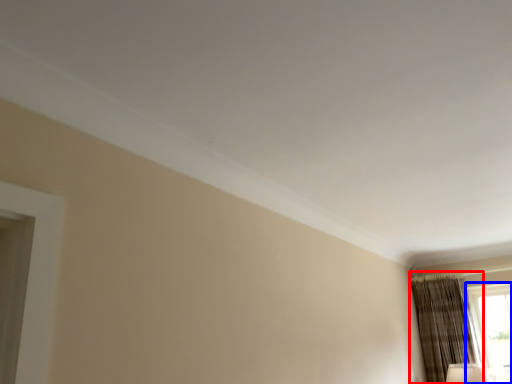
Question: Which object appears farthest to the camera in this image, curtain (highlighted by a red box) or window (highlighted by a blue box)?

Choices:
 (A) curtain
 (B) window

Answer: (B)